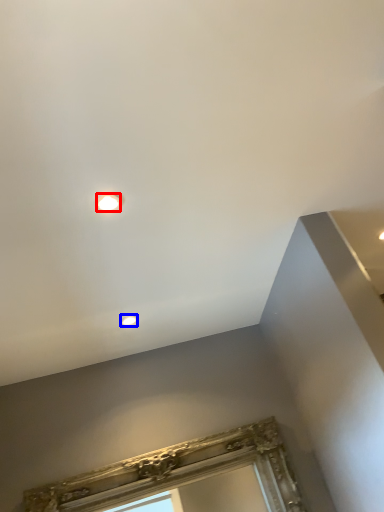
Question: Which object is closer to the camera taking this photo, droplight (highlighted by a red box) or droplight (highlighted by a blue box)?

Choices:
 (A) droplight
 (B) droplight

Answer: (A)